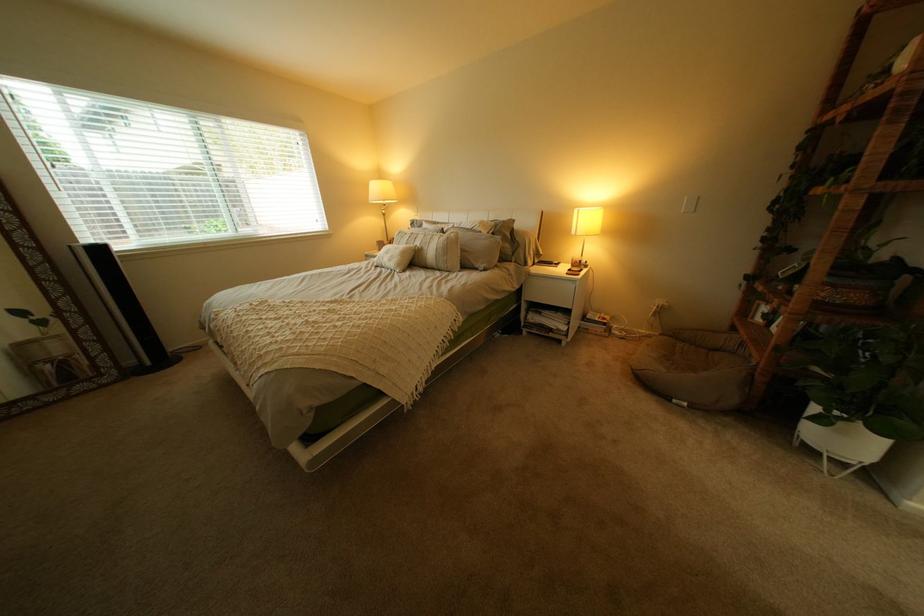
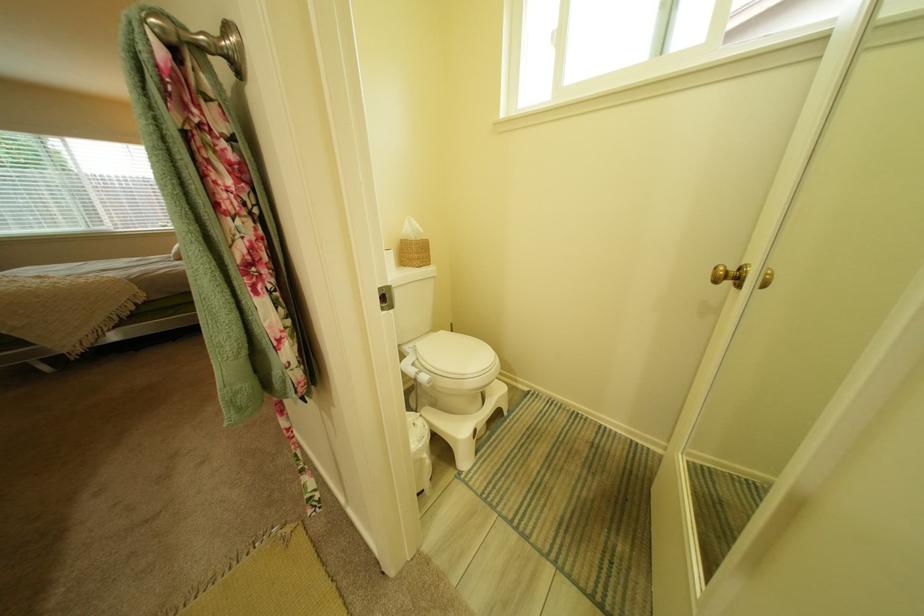
Question: What movement of the cameraman would produce the second image?

Choices:
 (A) Left
 (B) Right
 (C) Forward
 (D) Backward

Answer: (B)